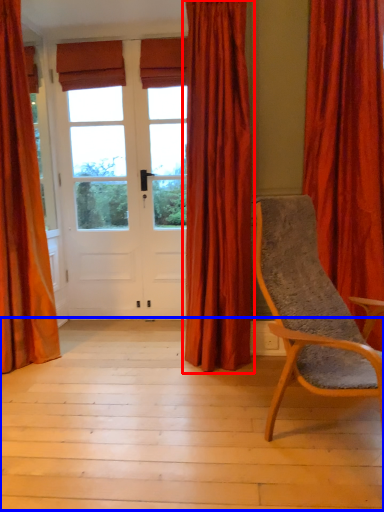
Question: Among these objects, which one is farthest to the camera, curtain (highlighted by a red box) or porch (highlighted by a blue box)?

Choices:
 (A) curtain
 (B) porch

Answer: (A)